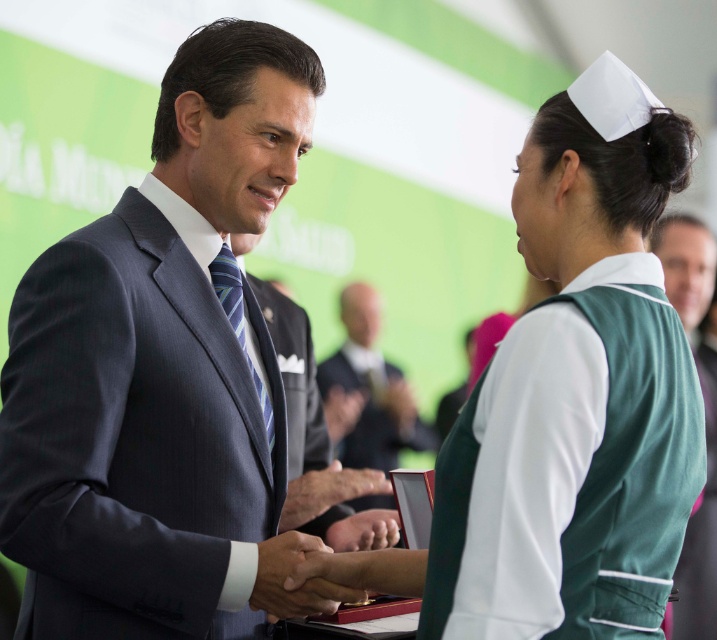
Does green fabric vest at center appear under smooth leather hand at center?

No.

Can you confirm if green fabric vest at center is positioned above smooth leather hand at center?

Yes, green fabric vest at center is above smooth leather hand at center.

The width and height of the screenshot is (717, 640). I want to click on green fabric vest at center, so click(x=701, y=536).

Does dark gray suit at center appear on the right side of smooth leather hand at center?

No, dark gray suit at center is not to the right of smooth leather hand at center.

Which is in front, point (49, 285) or point (328, 582)?

Point (49, 285)

Where is `dark gray suit at center`? The width and height of the screenshot is (717, 640). dark gray suit at center is located at coordinates (158, 368).

Locate an element on the screen. The width and height of the screenshot is (717, 640). white smooth nurse cap at upper center is located at coordinates (569, 401).

Locate an element on the screen. The height and width of the screenshot is (640, 717). white smooth nurse cap at upper center is located at coordinates (569, 401).